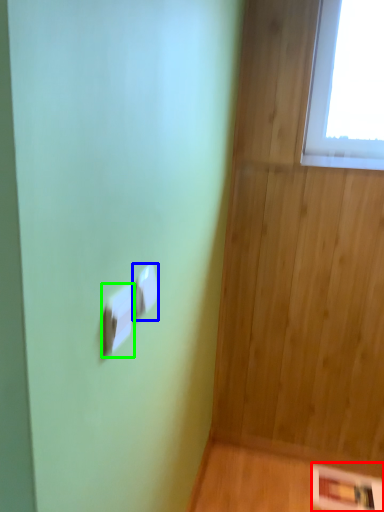
Question: Based on their relative distances, which object is nearer to panel (highlighted by a red box)? Choose from light switch (highlighted by a blue box) and light switch (highlighted by a green box).

Choices:
 (A) light switch
 (B) light switch

Answer: (A)